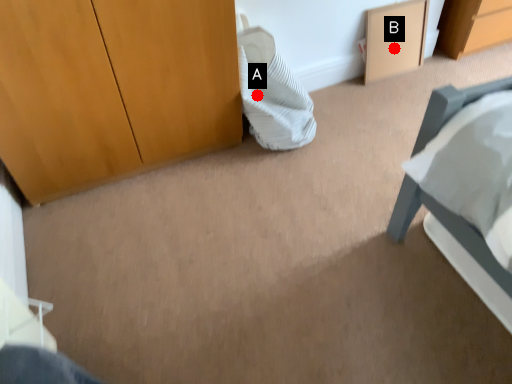
Question: Two points are circled on the image, labeled by A and B beside each circle. Among these points, which one is nearest to the camera?

Choices:
 (A) A is closer
 (B) B is closer

Answer: (A)